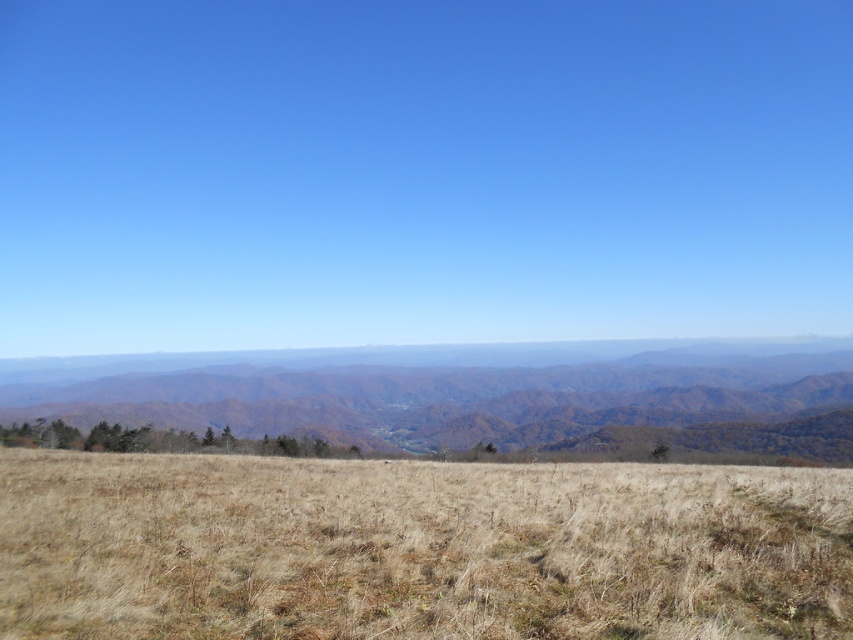
Who is more distant from viewer, (157, 513) or (258, 417)?

The point (258, 417) is more distant.

The image size is (853, 640). What do you see at coordinates (418, 548) in the screenshot? I see `brown dry grass at center` at bounding box center [418, 548].

Describe the element at coordinates (418, 548) in the screenshot. The width and height of the screenshot is (853, 640). I see `brown dry grass at center` at that location.

Where is `brown dry grass at center`? Image resolution: width=853 pixels, height=640 pixels. brown dry grass at center is located at coordinates (418, 548).